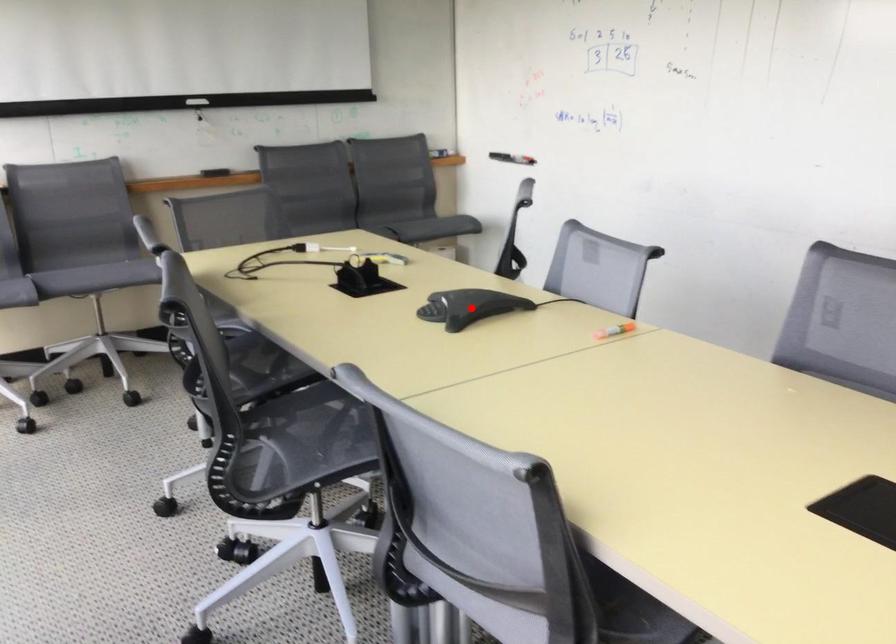
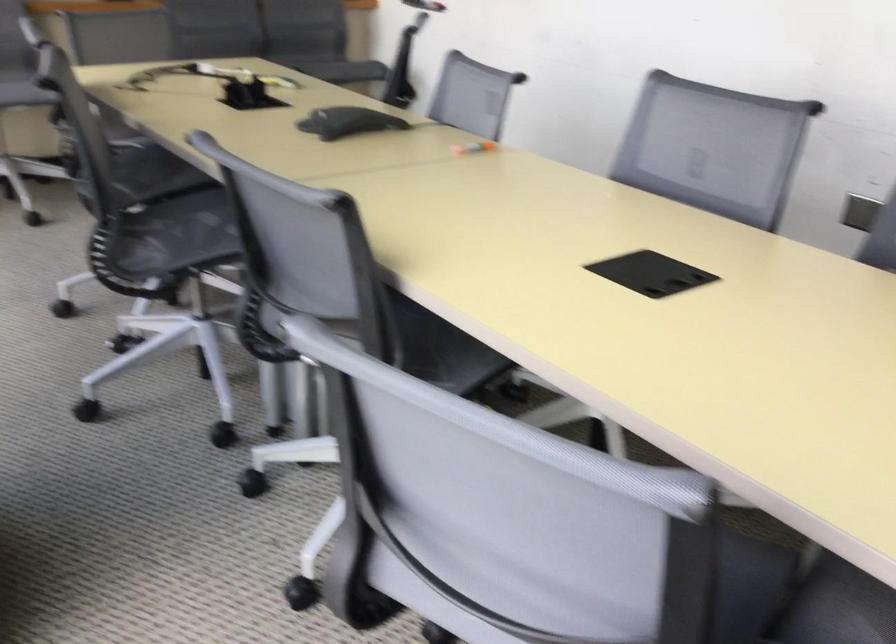
Find the pixel in the second image that matches the highlighted location in the first image.

(348, 122)